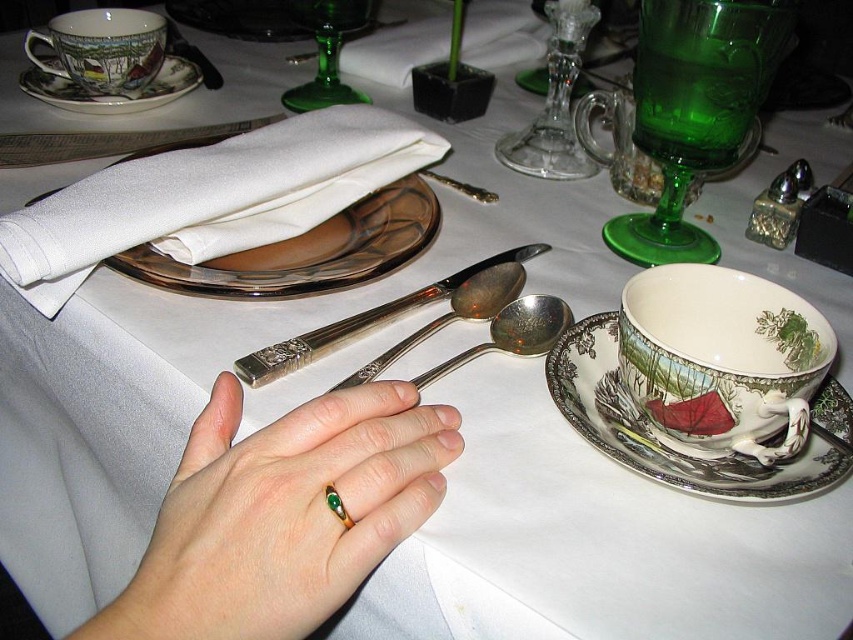
You are a server at a formal dinner. You need to place a dessert plate between the porcelain cup at right and the white porcelain plate at upper center. The dessert plate has a diameter of 9 inches. Can you fit it without overlapping either the cup or the plate?

The porcelain cup at right is 10.49 inches away from the white porcelain plate at upper center. Since the dessert plate has a diameter of 9 inches, there is enough space between them to place it without overlapping either object.